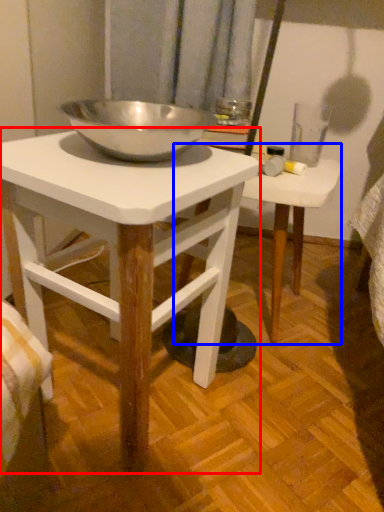
Question: Which of the following is the farthest to the observer, table (highlighted by a red box) or table (highlighted by a blue box)?

Choices:
 (A) table
 (B) table

Answer: (B)